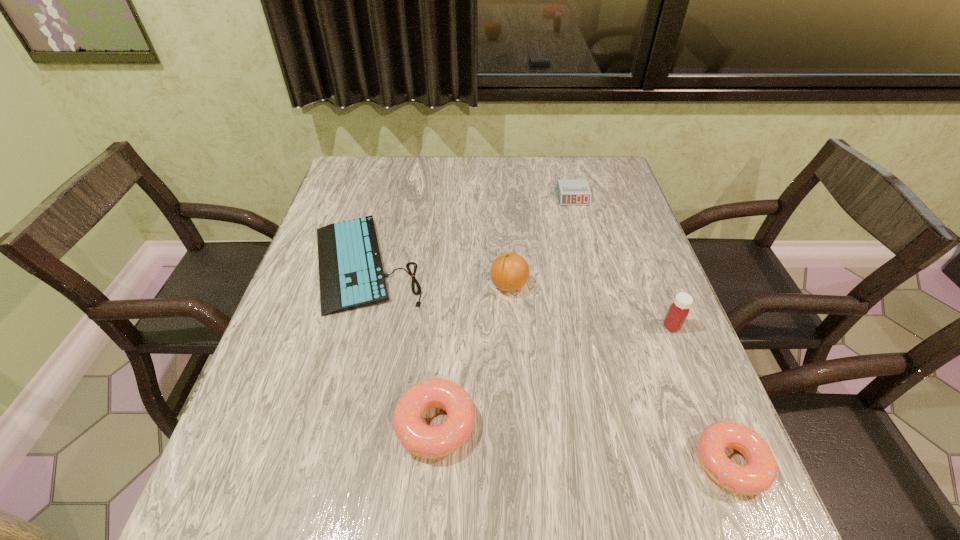
To make them evenly spaced by inserting another doughnut among them, please locate a free space for this new doughnut. Please provide its 2D coordinates. Your answer should be formatted as a tuple, i.e. [(x, y)], where the tuple contains the x and y coordinates of a point satisfying the conditions above.

[(578, 443)]